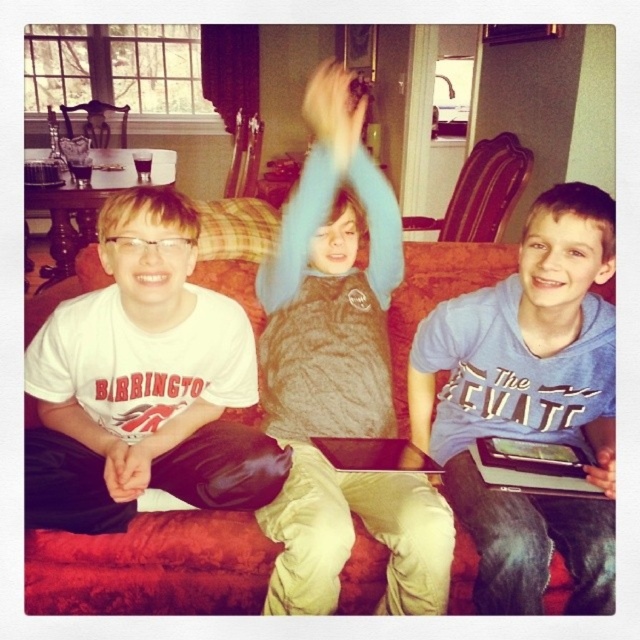
Question: Which point is farther to the camera?

Choices:
 (A) (148, 282)
 (B) (468, 349)

Answer: (B)

Question: Estimate the real-world distances between objects in this image. Which object is closer to the fluffy brown vest at center?

Choices:
 (A) blue cotton shirt at center
 (B) white cotton shirt at left
 (C) red fabric couch at center

Answer: (A)

Question: Does fluffy brown vest at center appear on the right side of blue cotton shirt at center?

Choices:
 (A) yes
 (B) no

Answer: (B)

Question: Which of these objects is positioned farthest from the red fabric couch at center?

Choices:
 (A) white cotton shirt at left
 (B) fluffy brown vest at center

Answer: (B)

Question: Does fluffy brown vest at center appear under white cotton shirt at left?

Choices:
 (A) yes
 (B) no

Answer: (B)

Question: Is fluffy brown vest at center to the right of red fabric couch at center from the viewer's perspective?

Choices:
 (A) yes
 (B) no

Answer: (A)